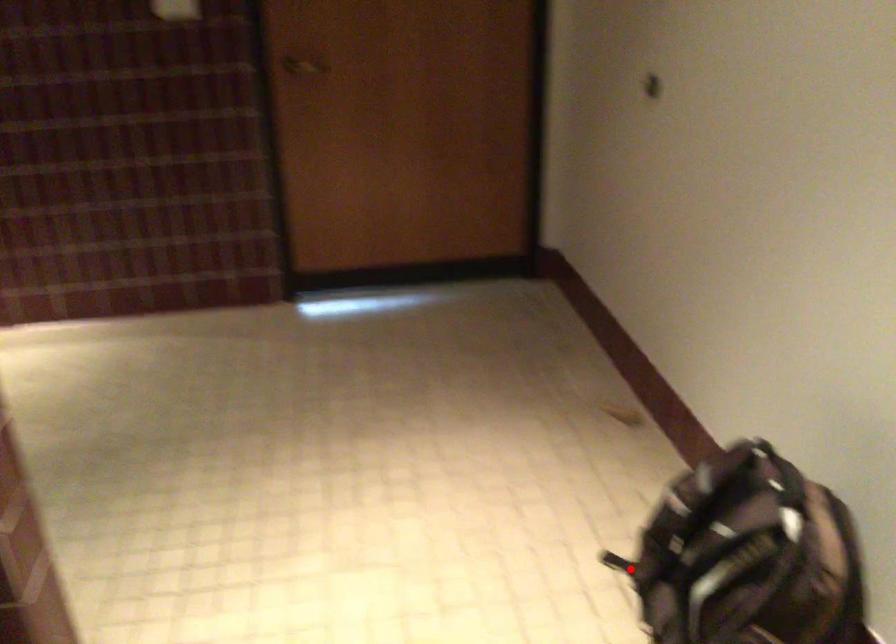
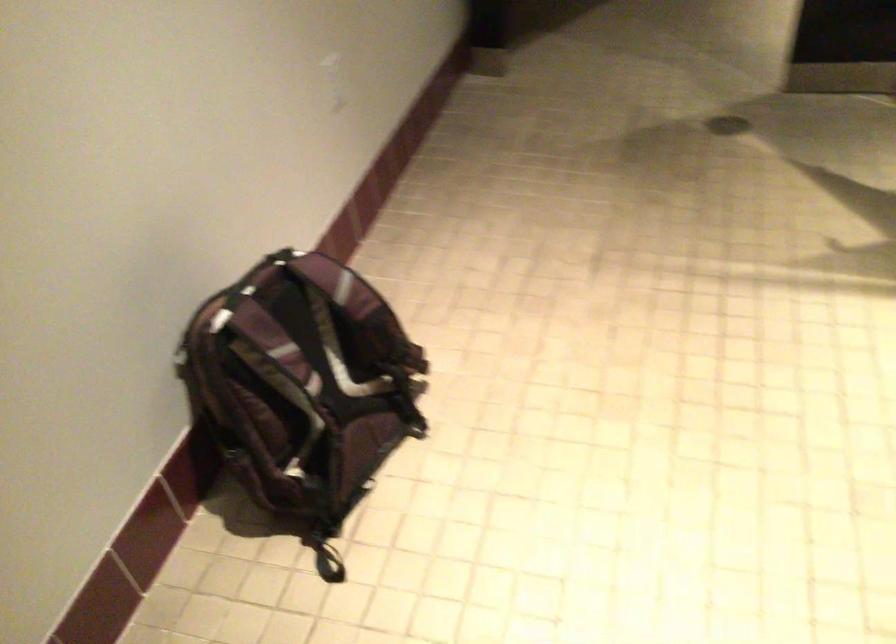
Question: I am providing you with two images of the same scene from different viewpoints. Image1 has a red point marked. In image2, the corresponding 3D location appears at what relative position? Reply with the corresponding letter.

Choices:
 (A) Closer
 (B) Farther

Answer: (A)